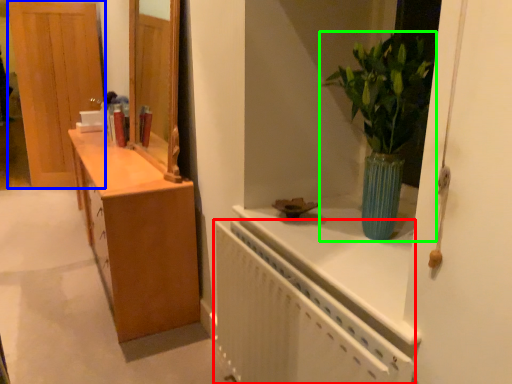
Question: Considering the real-world distances, which object is closest to radiator (highlighted by a red box)? door (highlighted by a blue box) or houseplant (highlighted by a green box).

Choices:
 (A) door
 (B) houseplant

Answer: (B)